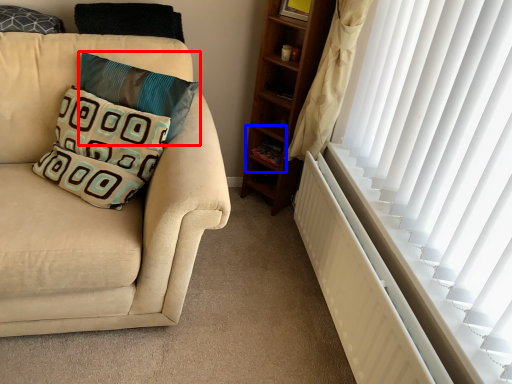
Question: Which point is further to the camera, pillow (highlighted by a red box) or shelf (highlighted by a blue box)?

Choices:
 (A) pillow
 (B) shelf

Answer: (B)